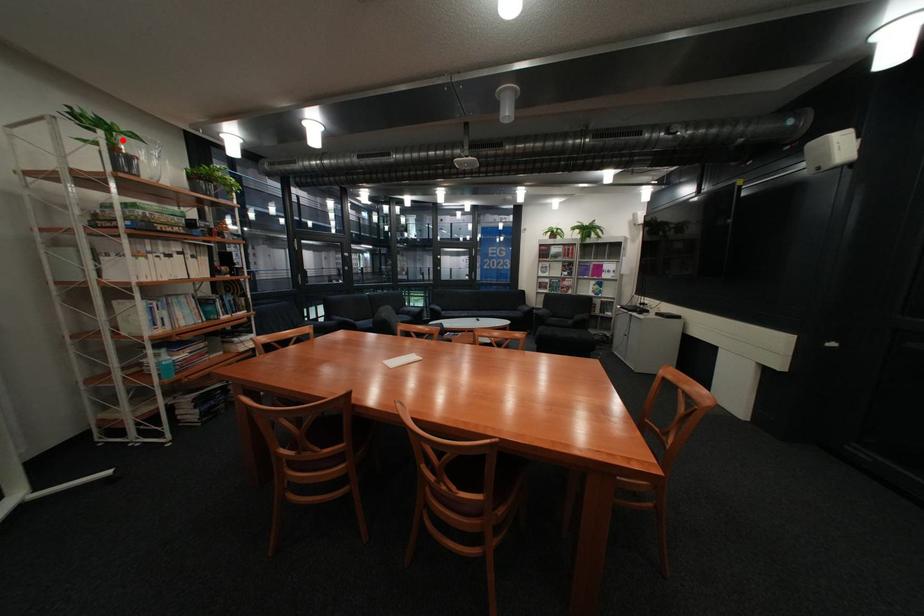
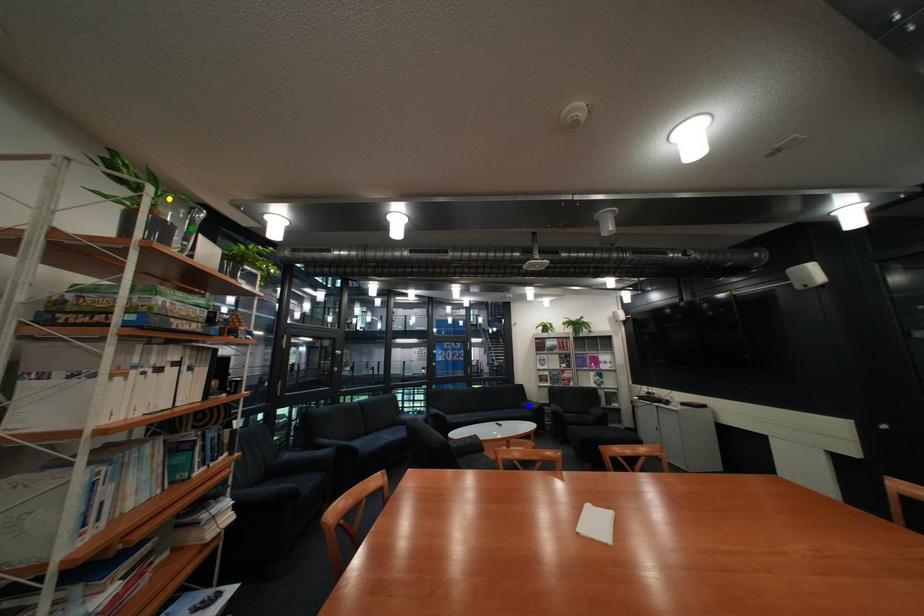
Question: I am providing you with two images of the same scene from different viewpoints. A red point is marked on the first image. You are given multiple points on the second image. In image 2, which mark is for the same physical point as the one in image 1?

Choices:
 (A) green point
 (B) blue point
 (C) yellow point

Answer: (C)